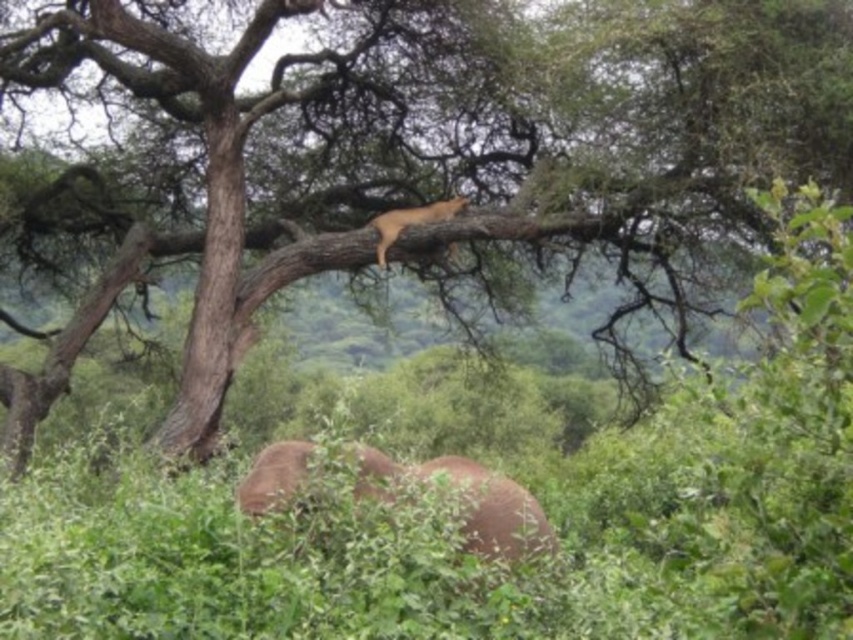
You are standing in the middle of the scene. Which object is closer to your left side, the brown matte elephant at lower center or the golden fur cat at upper center?

The golden fur cat at upper center is closer to your left side because the brown matte elephant at lower center is to the right of it.

You are a wildlife photographer trying to capture both the brown matte elephant at lower center and the golden fur cat at upper center in the same frame. Given that your camera has a maximum zoom range that can cover 5 meters between objects, will you be able to include both in a single shot?

The brown matte elephant at lower center and the golden fur cat at upper center are 4.08 meters apart. Since the camera can cover up to 5 meters, you can include both in a single shot as the distance is within the maximum zoom range.